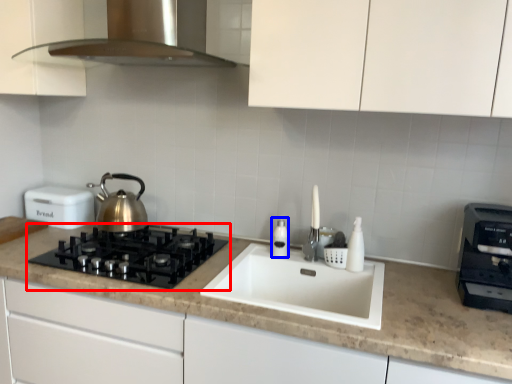
Question: Which object is closer to the camera taking this photo, gas stove (highlighted by a red box) or bottle (highlighted by a blue box)?

Choices:
 (A) gas stove
 (B) bottle

Answer: (A)